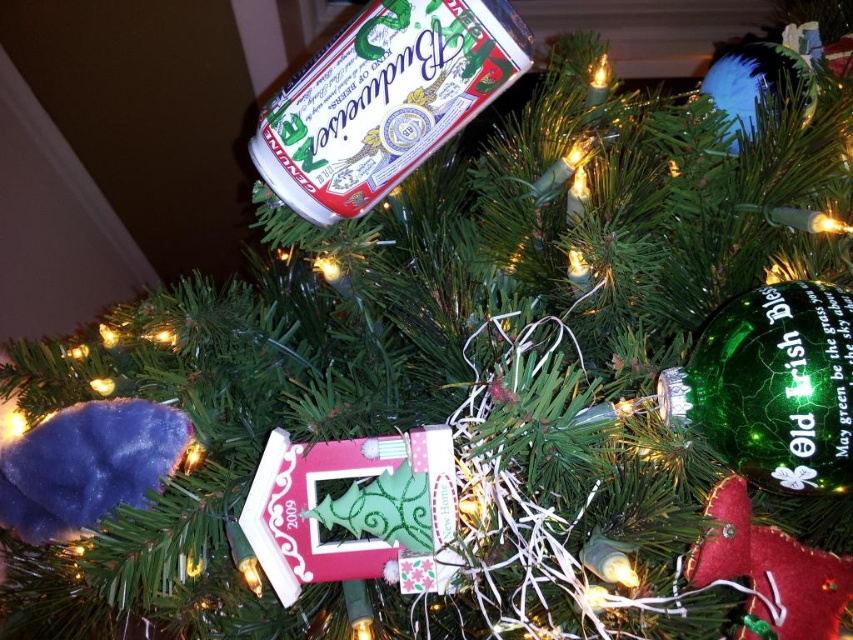
You are standing in front of the Christmas tree and want to place a new decoration. The Budweiser beer can is currently placed at point (384,100). Where is the Budweiser beer can located on the tree?

The metallic silver can at upper center is located at point (384,100).

You are a Christmas decoration organizer. You need to decide which decoration to move first based on their sizes. Which decoration should you move first, the metallic silver can at upper center or the green glass ornament at upper right?

The metallic silver can at upper center is larger in size than the green glass ornament at upper right, so you should move the metallic silver can at upper center first.

You are hanging ornaments on the Christmas tree and want to place a new decoration between the metallic silver can at upper center and the green glass ornament at upper right. Based on their sizes, which one should you place the new decoration closer to?

The metallic silver can at upper center is much taller than the green glass ornament at upper right, so the new decoration should be placed closer to the metallic silver can at upper center to maintain balance.